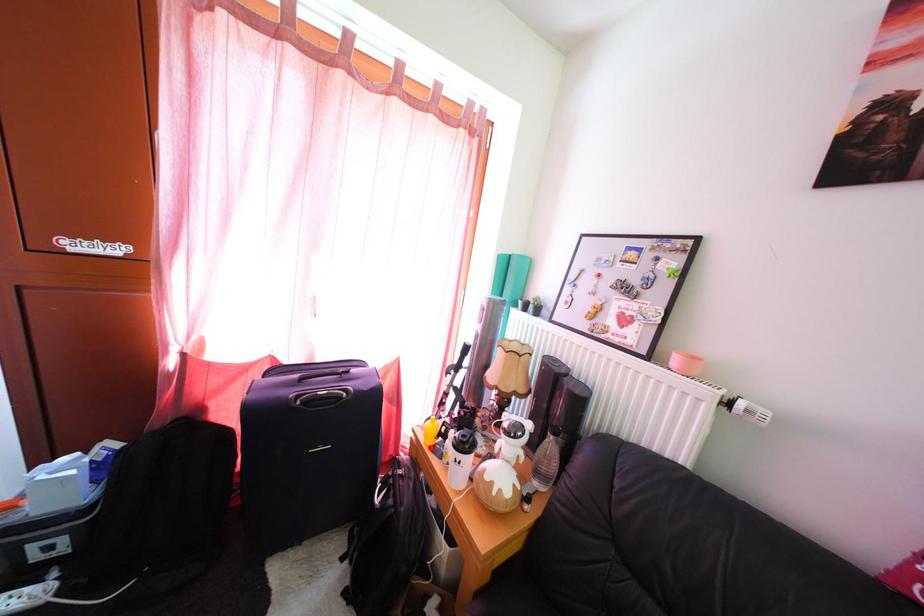
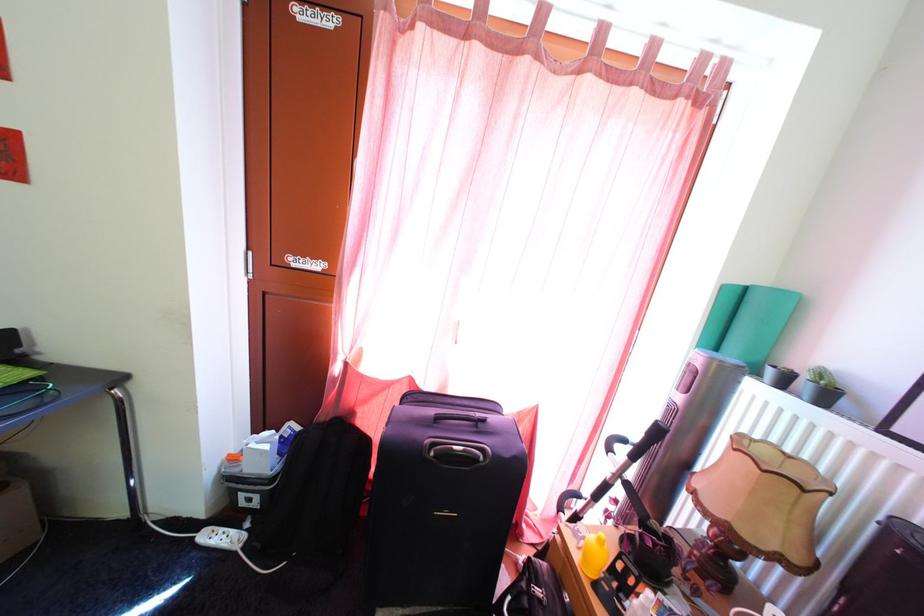
Find the pixel in the second image that matches the highlighted location in the first image.

(585, 565)